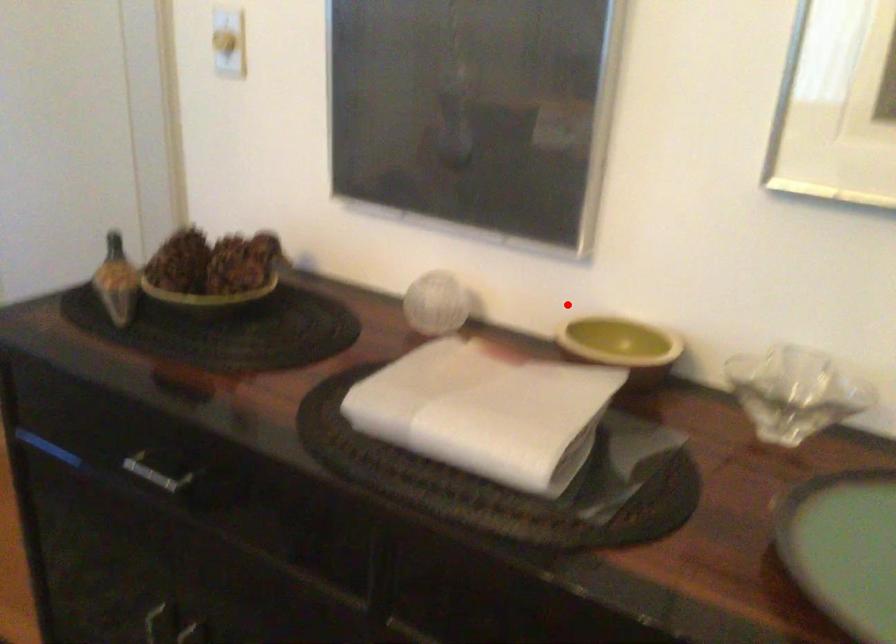
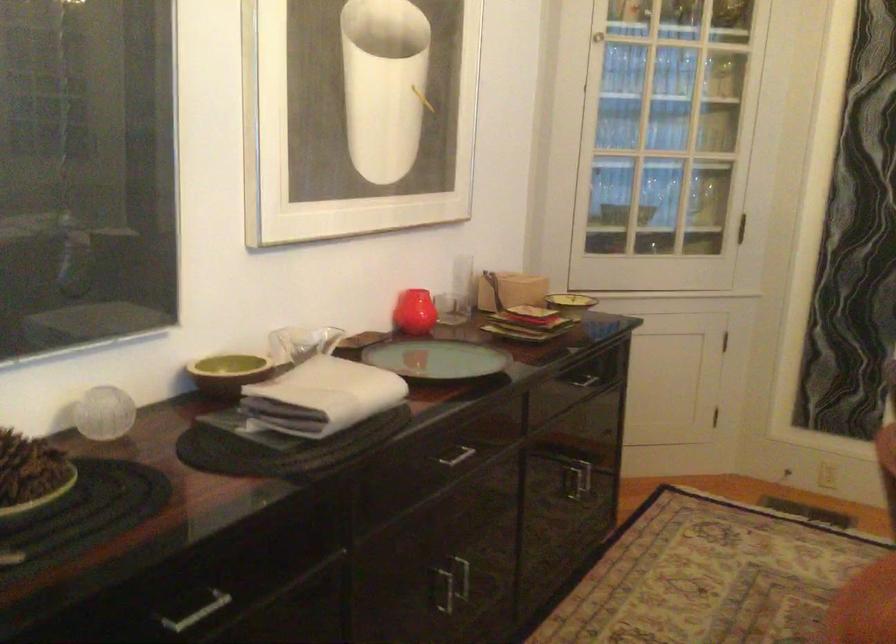
Question: I am providing you with two images of the same scene from different viewpoints. A red point is shown in image1. For the corresponding object point in image2, is it positioned nearer or farther from the camera?

Choices:
 (A) Nearer
 (B) Farther

Answer: (B)